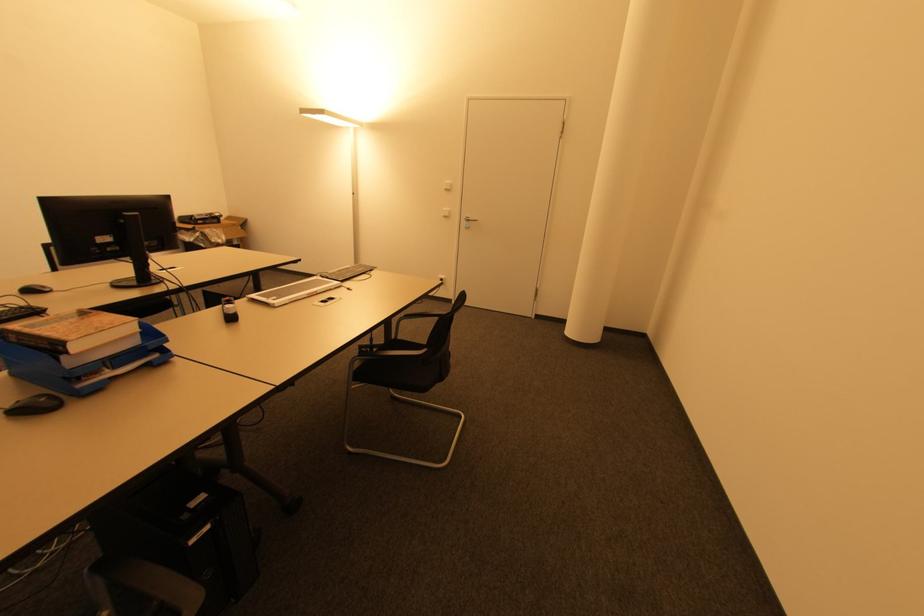
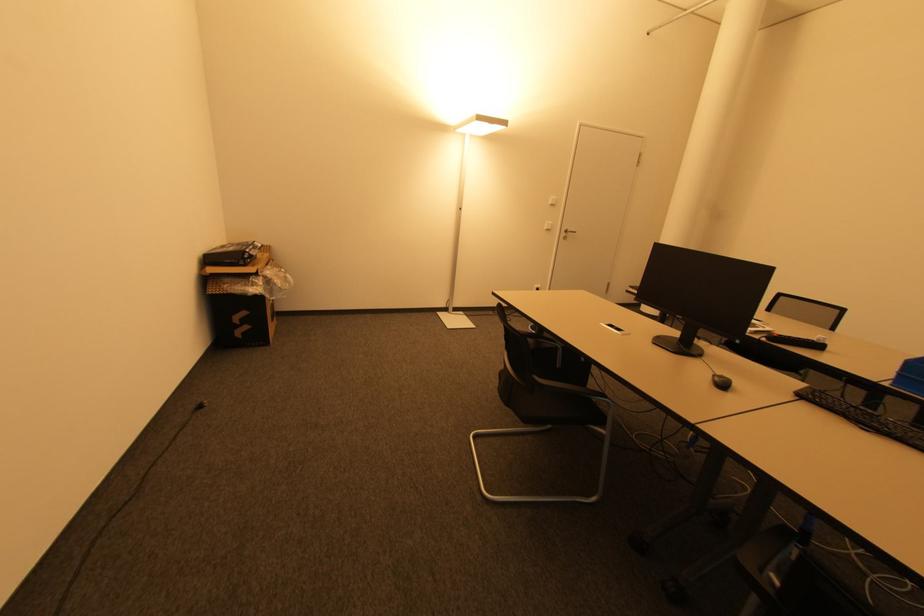
Where in the second image is the point corresponding to [447,188] from the first image?

(554, 204)